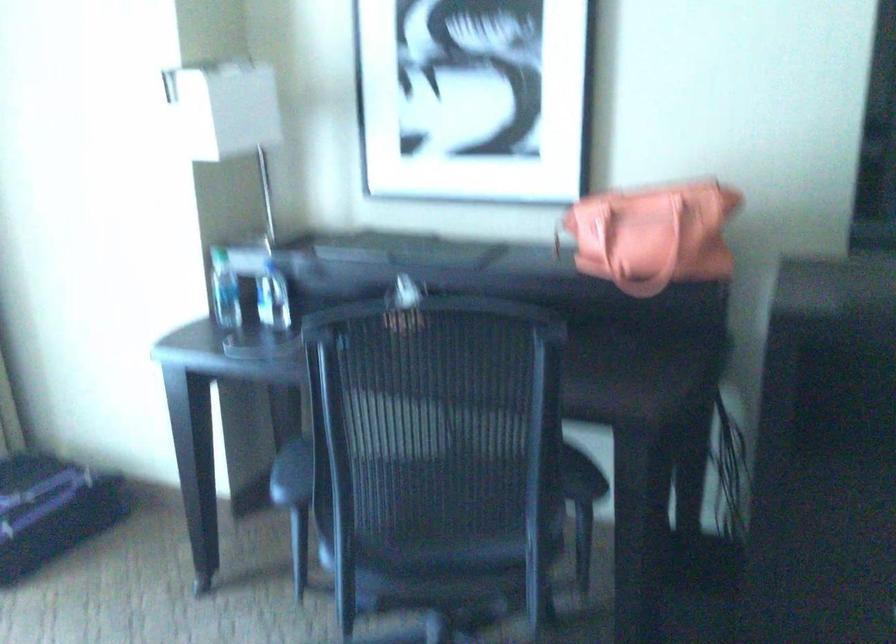
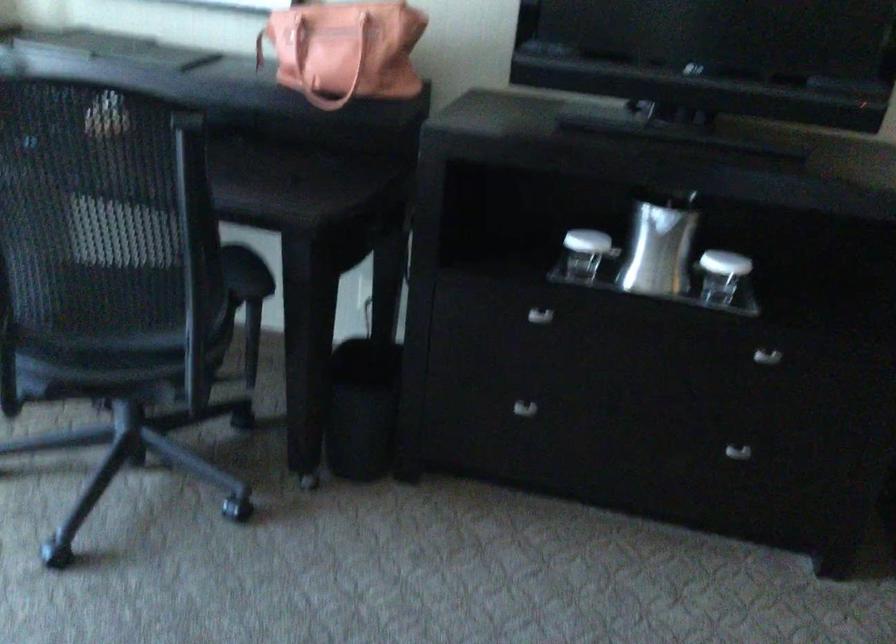
Locate, in the second image, the point that corresponds to the point at 444,476 in the first image.

(107, 265)